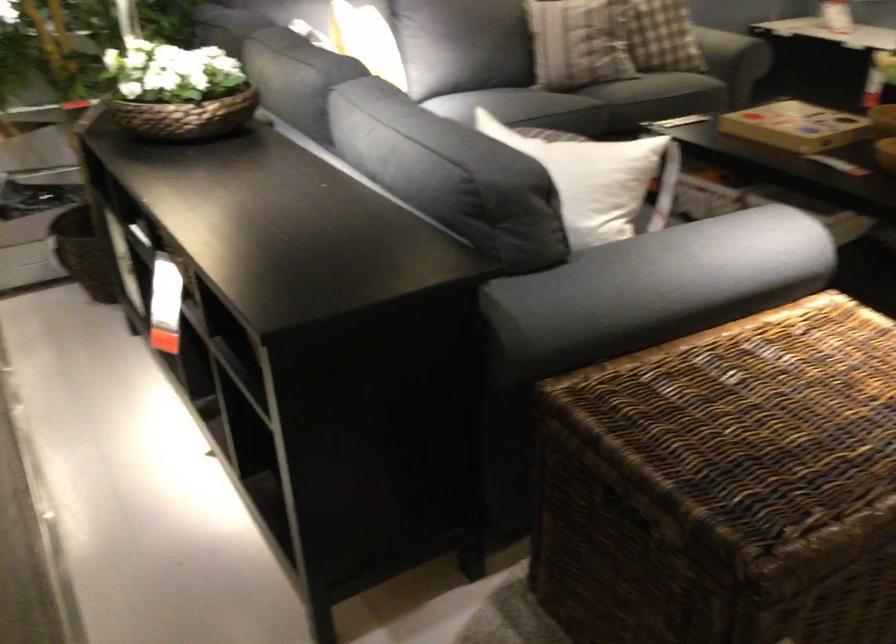
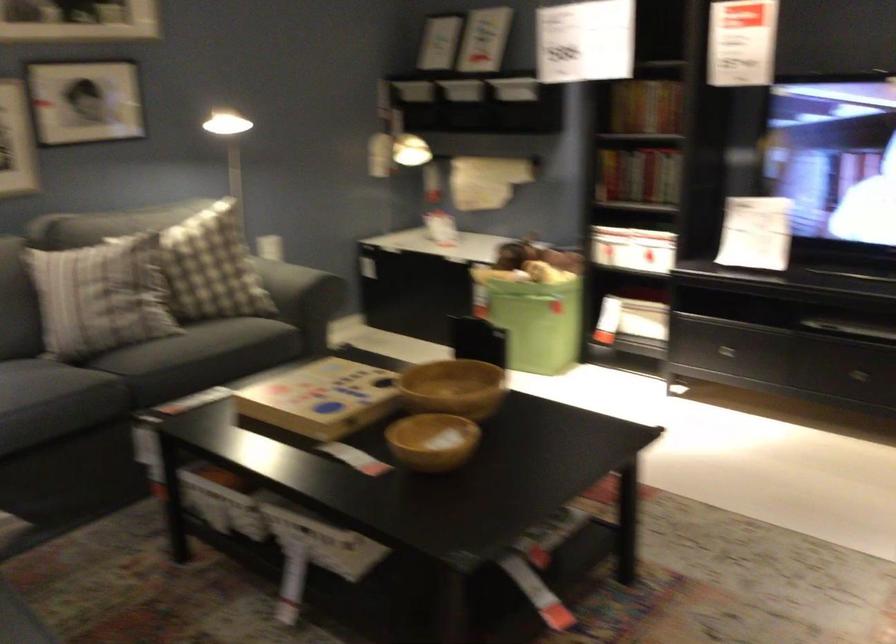
In a continuous first-person perspective shot, in which direction is the camera moving?

The cameraman walked toward right, forward.